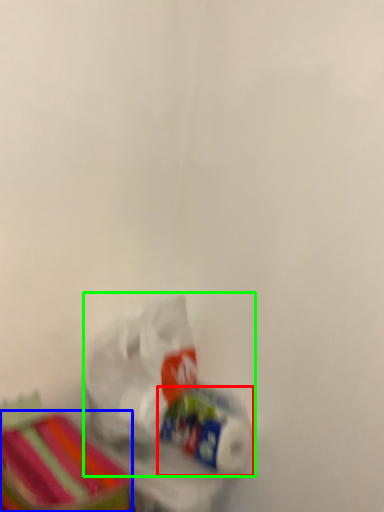
Question: Which is farther away from toilet paper (highlighted by a red box)? storage box (highlighted by a blue box) or plastic bag (highlighted by a green box)?

Choices:
 (A) storage box
 (B) plastic bag

Answer: (A)